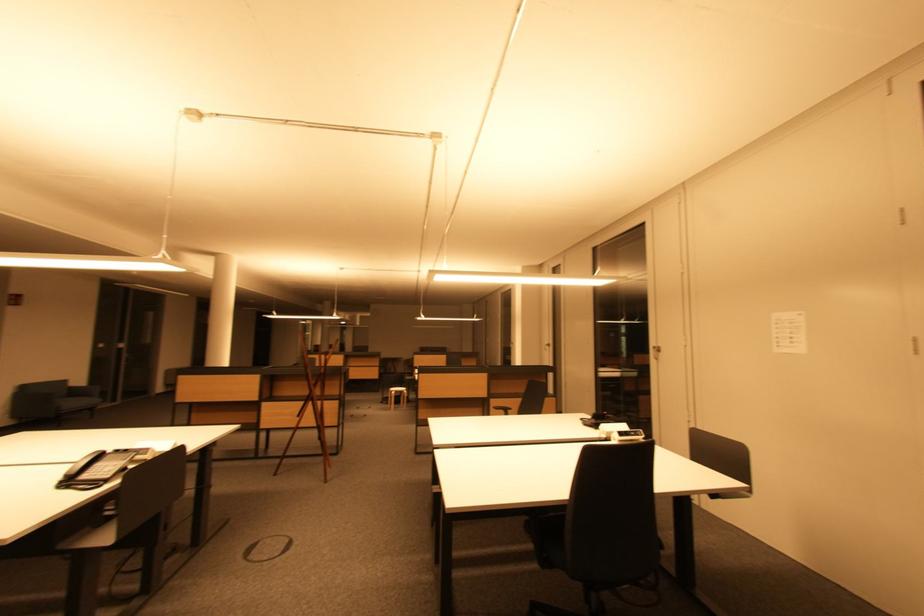
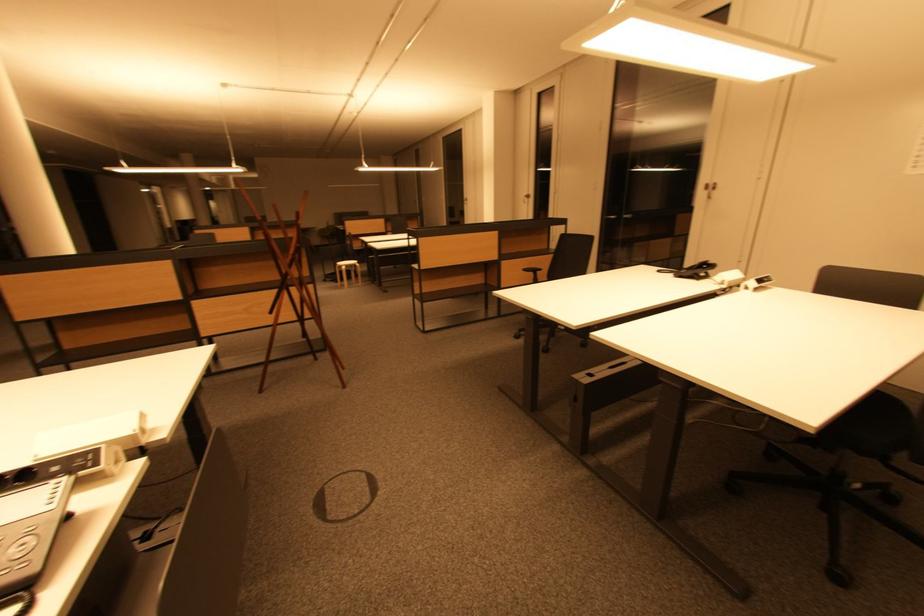
Based on the photo, which direction would the cameraman need to move to produce the second image?

The cameraman walked toward left, forward.